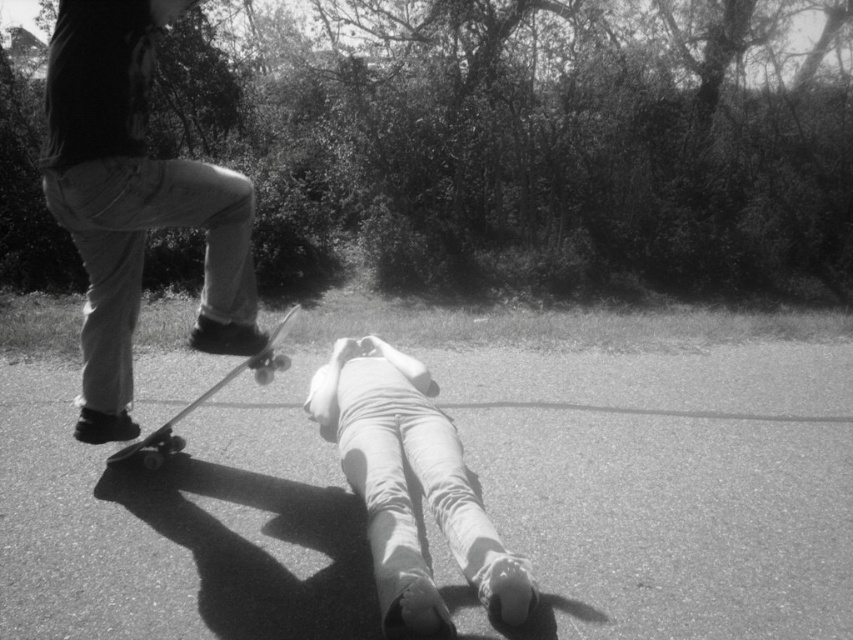
Question: Which object appears farthest from the camera in this image?

Choices:
 (A) denim jeans at center
 (B) smooth wood skateboard at lower left
 (C) dark gray jeans at left

Answer: (B)

Question: Is denim jeans at center smaller than smooth wood skateboard at lower left?

Choices:
 (A) yes
 (B) no

Answer: (B)

Question: Which point appears closest to the camera in this image?

Choices:
 (A) (152, 456)
 (B) (471, 524)
 (C) (247, 220)

Answer: (B)

Question: Which of the following is the closest to the observer?

Choices:
 (A) (152, 452)
 (B) (364, 353)
 (C) (195, 220)

Answer: (C)

Question: Considering the relative positions of dark gray jeans at left and denim jeans at center in the image provided, where is dark gray jeans at left located with respect to denim jeans at center?

Choices:
 (A) above
 (B) below

Answer: (A)

Question: Does dark gray jeans at left have a smaller size compared to smooth wood skateboard at lower left?

Choices:
 (A) no
 (B) yes

Answer: (A)